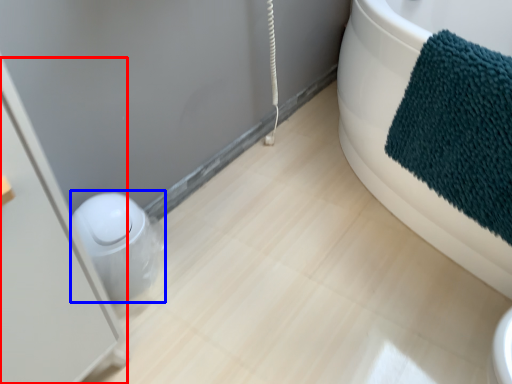
Question: Which object appears closest to the camera in this image, screen door (highlighted by a red box) or toilet bowl (highlighted by a blue box)?

Choices:
 (A) screen door
 (B) toilet bowl

Answer: (A)